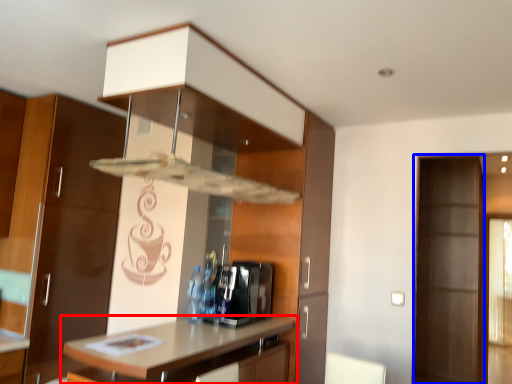
Question: Which object appears closest to the camera in this image, countertop (highlighted by a red box) or screen door (highlighted by a blue box)?

Choices:
 (A) countertop
 (B) screen door

Answer: (A)